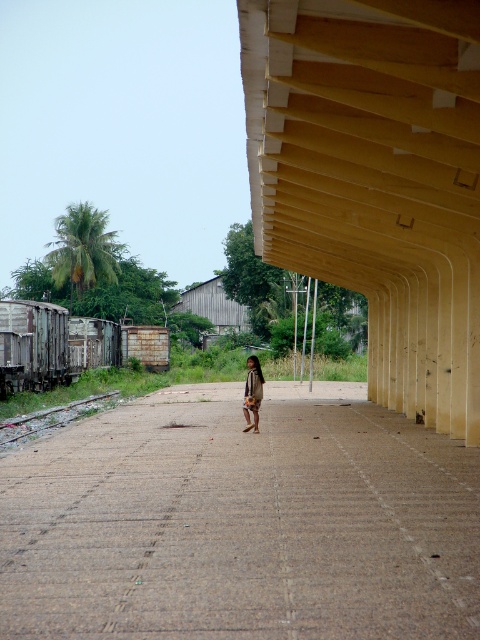
Does brown textured pavement at center have a lesser height compared to brown textured shirt at center?

Yes, brown textured pavement at center is shorter than brown textured shirt at center.

Does point (111, 563) come in front of point (256, 392)?

Yes, point (111, 563) is closer to viewer.

The width and height of the screenshot is (480, 640). Identify the location of brown textured pavement at center. (240, 522).

Does brown textured pavement at center have a greater height compared to rusty metal train track at lower left?

Indeed, brown textured pavement at center has a greater height compared to rusty metal train track at lower left.

Who is taller, brown textured pavement at center or rusty metal train track at lower left?

Standing taller between the two is brown textured pavement at center.

Who is more distant from viewer, (402,515) or (21,419)?

Positioned behind is point (21,419).

The height and width of the screenshot is (640, 480). What are the coordinates of `brown textured pavement at center` in the screenshot? It's located at (240, 522).

Does point (54, 413) lie behind point (240, 326)?

No.

From the picture: Who is taller, rusty metal train track at lower left or wooden hut at center?

wooden hut at center

Is point (17, 435) closer to viewer compared to point (231, 328)?

Yes, point (17, 435) is closer to viewer.

At what (x,y) coordinates should I click in order to perform the action: click on rusty metal train track at lower left. Please return your answer as a coordinate pair (x, y). Image resolution: width=480 pixels, height=640 pixels. Looking at the image, I should click on (51, 417).